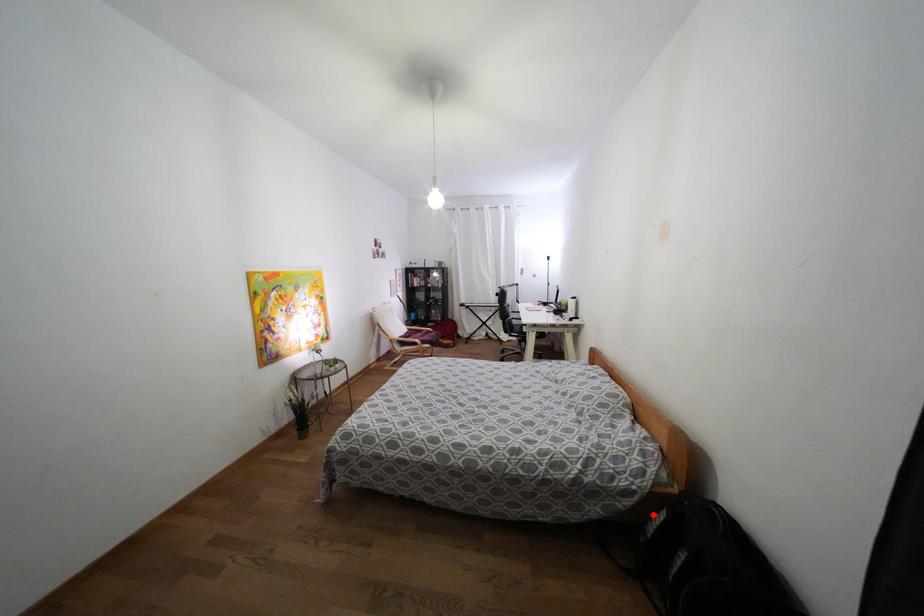
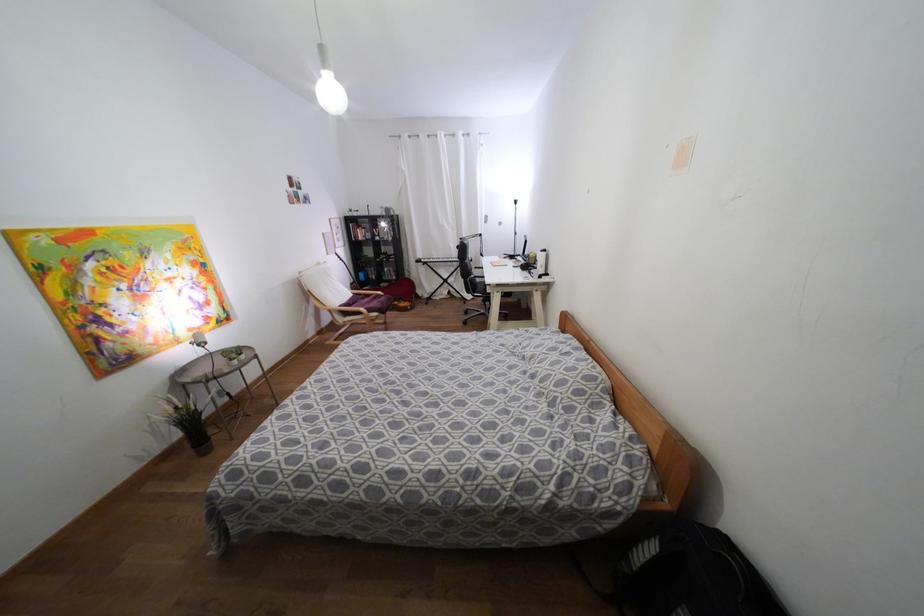
Find the pixel in the second image that matches the highlighted location in the first image.

(640, 541)